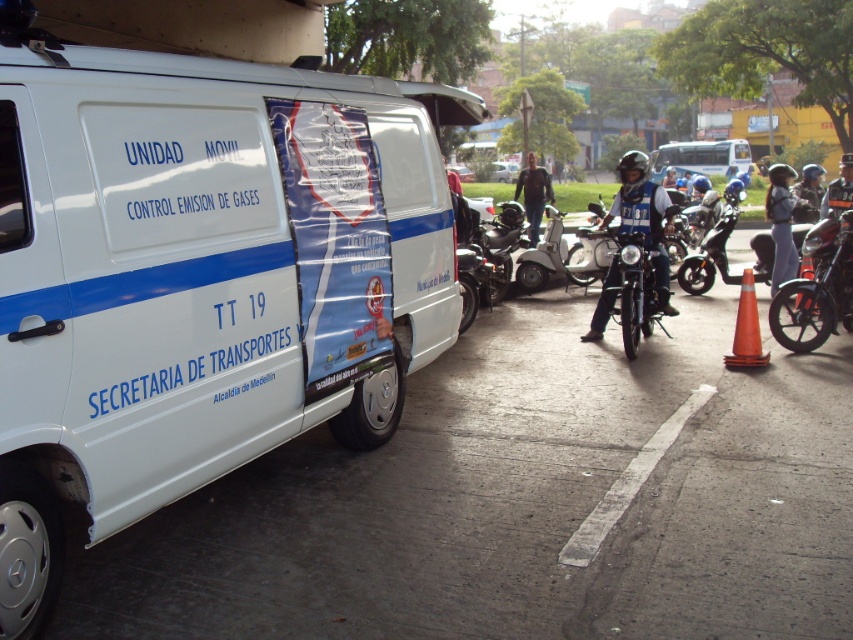
You are a pedestrian standing next to the shiny black motorcycle at right. You want to cross the street to reach the white van parked nearby. The road has a speed limit of 40 km per hour. According to traffic safety guidelines, what is the minimum safe distance you should maintain between yourself and any approaching vehicles before starting to cross?

The minimum safe distance is typically calculated based on the speed of the vehicle and reaction time. At 40 km per hour, a safe distance would be around 20 meters. Since you and the shiny black motorcycle at right are 8.30 meters apart, you should wait until any approaching vehicles are at least 20 meters away before starting to cross.

You are a delivery person who needs to park your motorcycle between the shiny black motorcycle at right and the shiny black motorcycle at center. Which motorcycle should you place your motorcycle next to if you want to park closer to the taller motorcycle?

The shiny black motorcycle at center is taller than the shiny black motorcycle at right. Therefore, to park closer to the taller motorcycle, you should position your motorcycle next to the shiny black motorcycle at center.

You are standing in front of the white van from the image. There are two points marked on the van. The first point is at coordinate point (782, 291) and the second is at point (705, 269). Which point is closer to you?

Point (782, 291) is closer to the camera than point (705, 269).